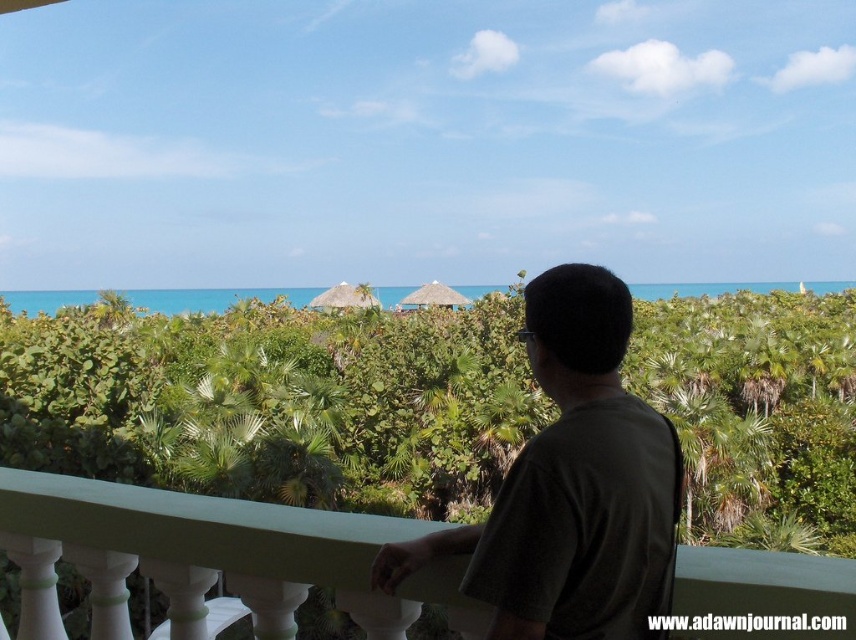
You are standing on the balcony and want to look at two points in the scene. The first point is at coordinates point (27,636) and the second is at point (473,552). Which point will appear closer to you when you look at them?

Point (27,636) is further to the viewer than point (473,552), so the first point will appear closer to you.